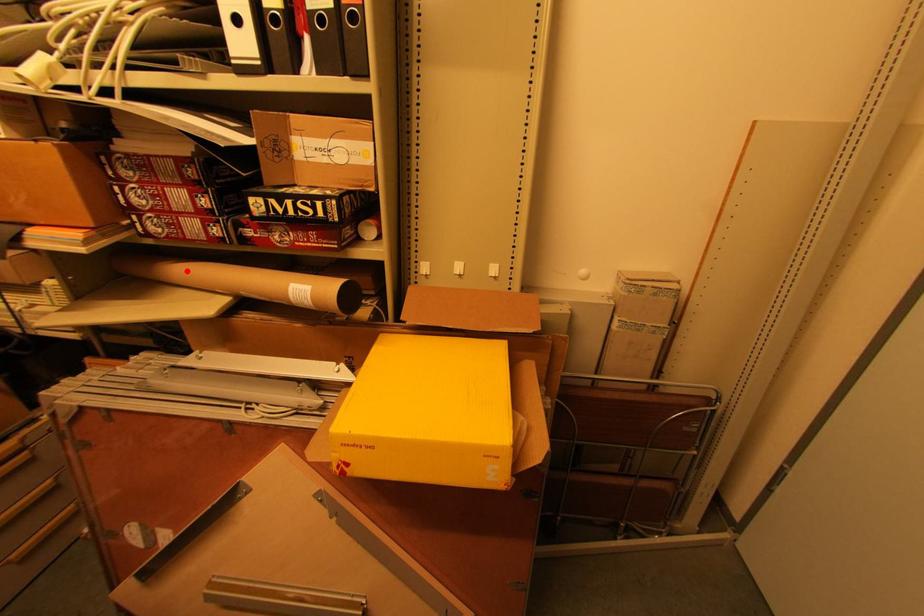
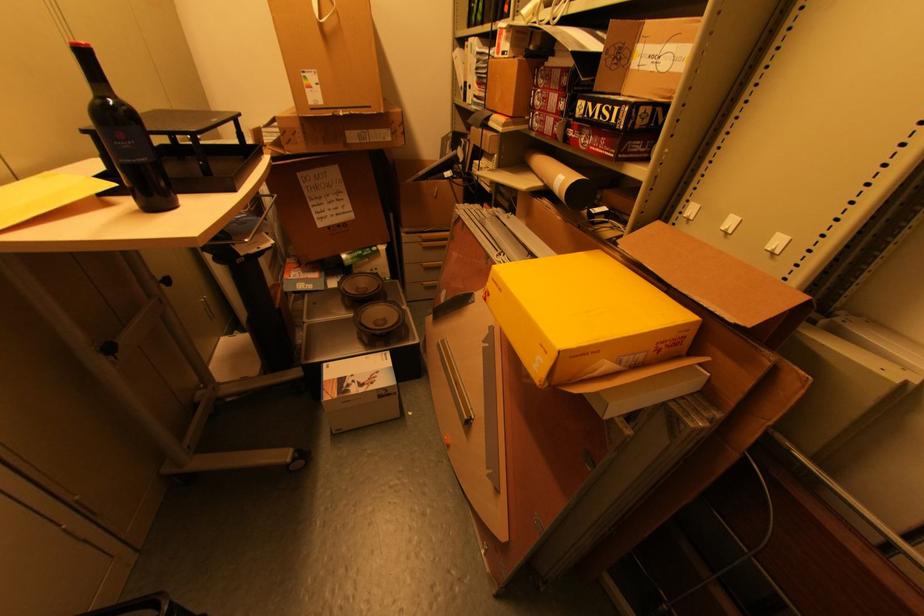
The point at the highlighted location is marked in the first image. Where is the corresponding point in the second image?

(542, 161)